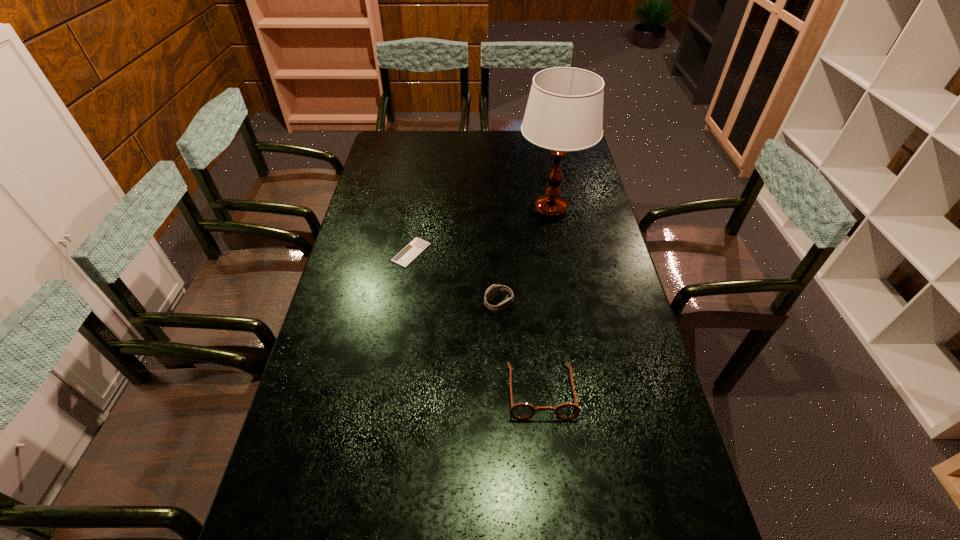
Identify the location of vacant area situated on the face of the third farthest object. The width and height of the screenshot is (960, 540). (416, 304).

The height and width of the screenshot is (540, 960). Identify the location of free space located 0.140m on the front of the third nearest object. (403, 300).

This screenshot has width=960, height=540. Find the location of `object that is positioned at the left edge`. object that is positioned at the left edge is located at coordinates (416, 246).

Locate an element on the screen. This screenshot has width=960, height=540. object at the right edge is located at coordinates (564, 112).

This screenshot has width=960, height=540. In order to click on vacant space at the far edge in this screenshot , I will do `click(446, 146)`.

Where is `vacant space at the left edge`? vacant space at the left edge is located at coordinates (301, 521).

Find the location of a particular element. This screenshot has width=960, height=540. vacant space at the right edge is located at coordinates (658, 461).

Where is `free space between the watch and the second farthest object`? This screenshot has width=960, height=540. free space between the watch and the second farthest object is located at coordinates (455, 278).

Find the location of a particular element. Image resolution: width=960 pixels, height=540 pixels. vacant region between the watch and the shortest object is located at coordinates (455, 278).

Find the location of a particular element. empty location between the farthest object and the nearest object is located at coordinates (545, 300).